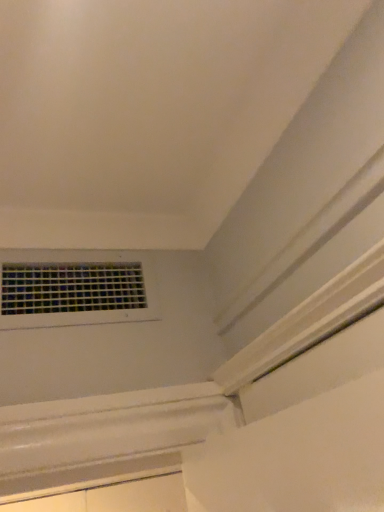
Measure the distance between point (9, 284) and camera.

The depth of point (9, 284) is 39.02 inches.

Describe the element at coordinates (75, 288) in the screenshot. I see `clear plastic grid at upper left` at that location.

The width and height of the screenshot is (384, 512). Identify the location of clear plastic grid at upper left. (75, 288).

Where is `clear plastic grid at upper left`? The width and height of the screenshot is (384, 512). clear plastic grid at upper left is located at coordinates (75, 288).